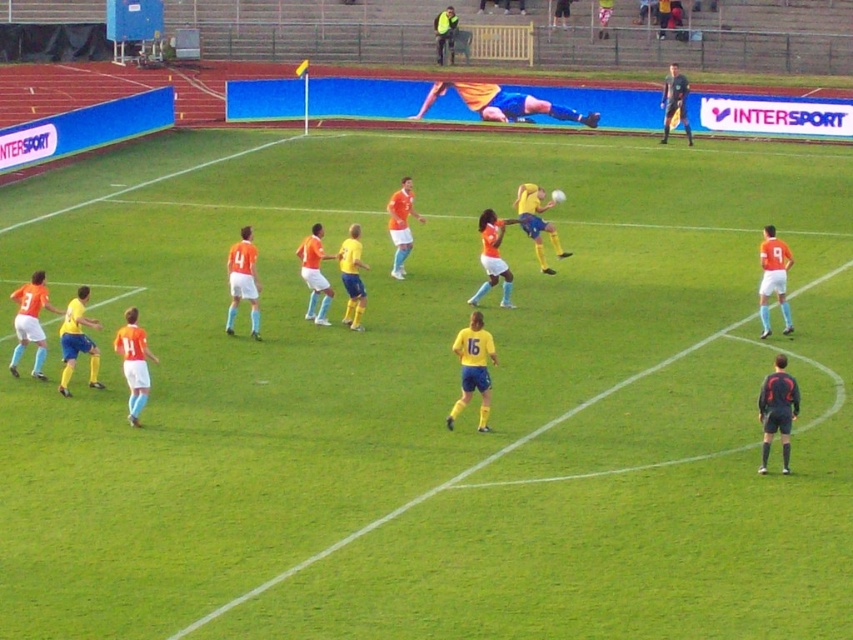
You are a photographer at the soccer match and want to capture a photo that includes both the yellow matte jersey at center and the yellow jersey at upper center. Based on their positions, which jersey is lower in the image?

The yellow matte jersey at center is located below the yellow jersey at upper center, so the yellow matte jersey at center is lower in the image.

You are a referee observing the soccer match. You notice the orange matte jersey at left and the yellow jersey at upper center. Which player is closer to the ground?

The orange matte jersey at left is closer to the ground because it is positioned under the yellow jersey at upper center.

You are a soccer referee observing the game. You notice the yellow matte jersey at center and the black jersey at right. Which player is closer to the soccer ball that is airborne in front of them? Please explain based on their positions.

The yellow matte jersey at center is closer to the soccer ball because the black jersey at right is behind the yellow matte jersey at center, meaning the yellow jersey player is in front and closer to the ball.